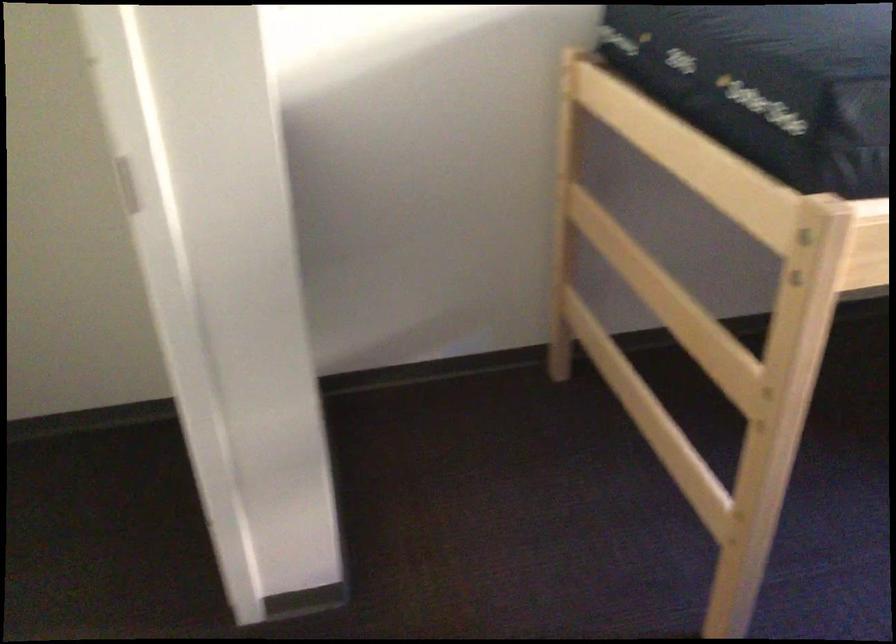
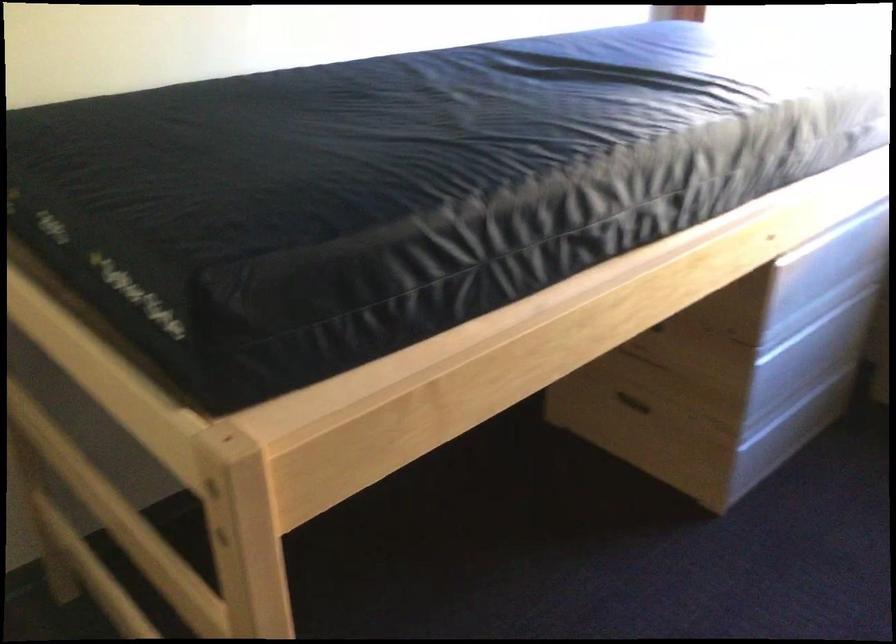
Locate, in the second image, the point that corresponds to point 586,402 in the first image.

(112, 632)